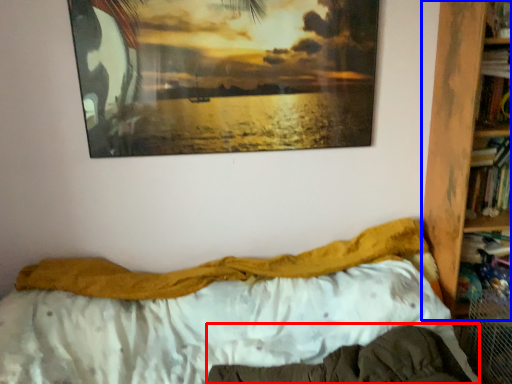
Question: Which of the following is the closest to the observer, mattress (highlighted by a red box) or bookcase (highlighted by a blue box)?

Choices:
 (A) mattress
 (B) bookcase

Answer: (A)